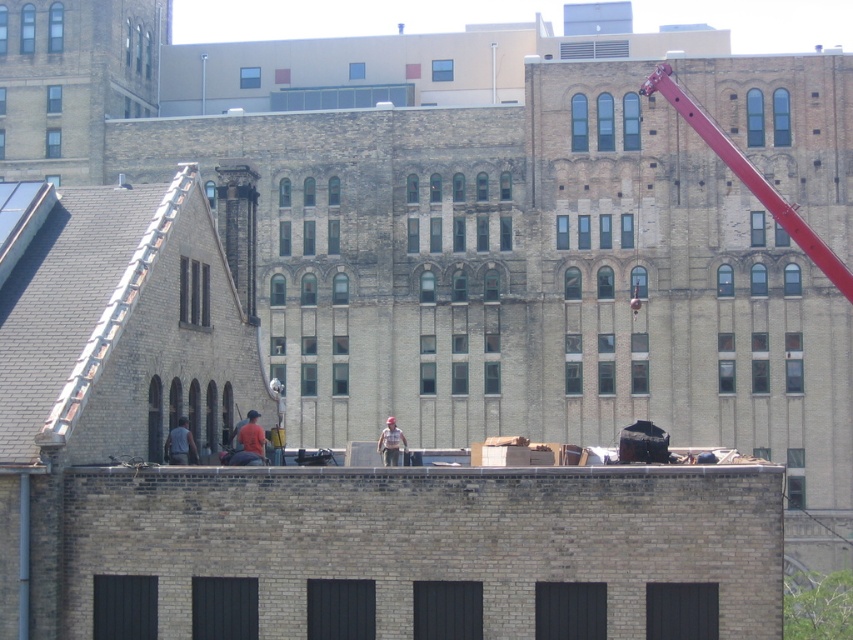
Is point (827, 250) positioned before point (167, 435)?

No, it is not.

Is the position of red metallic crane at upper right less distant than that of dark gray fabric jacket at center?

No, red metallic crane at upper right is behind dark gray fabric jacket at center.

Which is in front, point (756, 195) or point (172, 442)?

Point (172, 442)

Identify the location of red metallic crane at upper right. The height and width of the screenshot is (640, 853). (750, 177).

Which is behind, point (688, 97) or point (396, 433)?

The point (688, 97) is more distant.

Does red metallic crane at upper right appear on the left side of camouflage fabric worker at center?

Incorrect, red metallic crane at upper right is not on the left side of camouflage fabric worker at center.

What are the coordinates of `red metallic crane at upper right` in the screenshot? It's located at (750, 177).

Does dark gray fabric jacket at center come behind camouflage fabric worker at center?

That is False.

Who is positioned more to the right, dark gray fabric jacket at center or camouflage fabric worker at center?

From the viewer's perspective, camouflage fabric worker at center appears more on the right side.

This screenshot has width=853, height=640. I want to click on dark gray fabric jacket at center, so click(178, 444).